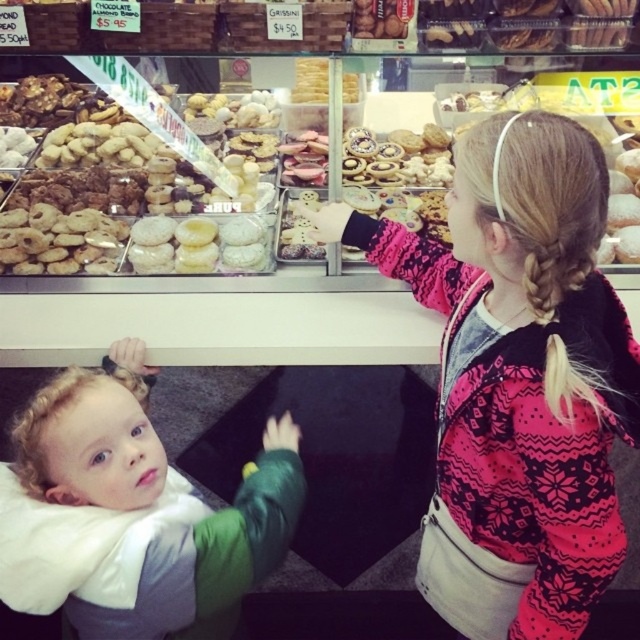
Who is higher up, pink sweater at upper right or curly blonde hair at lower left?

Positioned higher is pink sweater at upper right.

Does point (627, 368) come in front of point (81, 552)?

That is False.

Is point (566, 588) positioned after point (81, 484)?

That is True.

Locate an element on the screen. The image size is (640, 640). pink sweater at upper right is located at coordinates (516, 378).